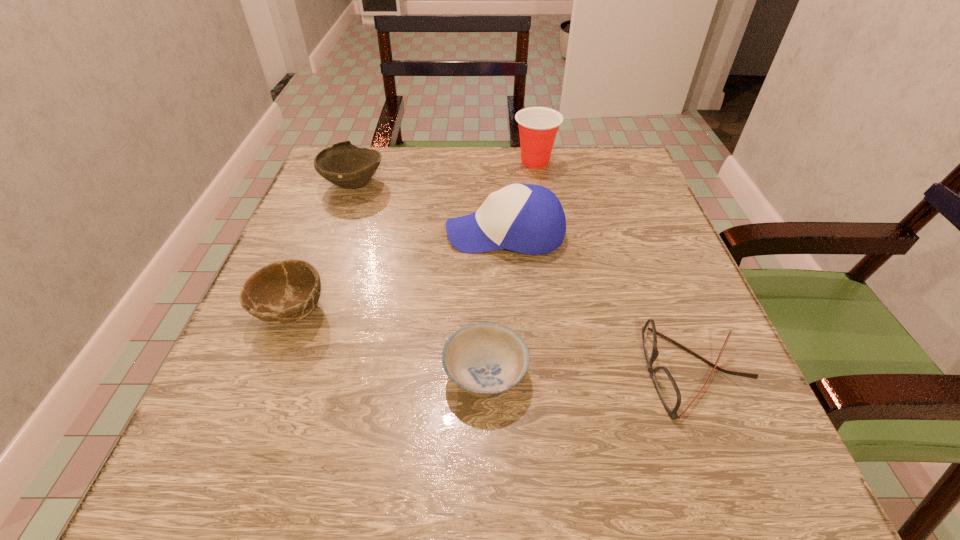
Image resolution: width=960 pixels, height=540 pixels. In order to click on cup in this screenshot , I will do `click(538, 126)`.

What are the coordinates of `baseball cap` in the screenshot? It's located at (526, 218).

Locate an element on the screen. The height and width of the screenshot is (540, 960). the farthest bowl is located at coordinates (343, 164).

Where is `the second nearest bowl`? This screenshot has width=960, height=540. the second nearest bowl is located at coordinates (282, 292).

This screenshot has height=540, width=960. I want to click on the shortest bowl, so click(x=486, y=360).

I want to click on the rightmost bowl, so click(486, 360).

Image resolution: width=960 pixels, height=540 pixels. I want to click on the rightmost object, so click(x=667, y=389).

The height and width of the screenshot is (540, 960). I want to click on vacant space situated on the left of the cup, so click(x=442, y=161).

Image resolution: width=960 pixels, height=540 pixels. I want to click on vacant space located 0.130m on the front-facing side of the baseball cap, so click(384, 233).

Find the location of `vacant region located 0.260m on the front-facing side of the baseball cap`. vacant region located 0.260m on the front-facing side of the baseball cap is located at coordinates (321, 233).